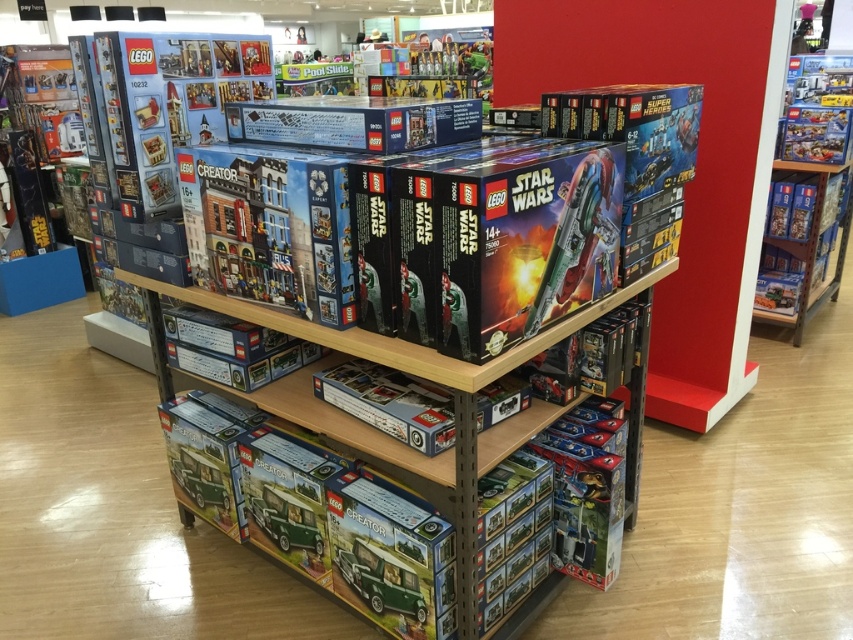
Question: Is matte blue building at center wider than green matte van at lower center?

Choices:
 (A) yes
 (B) no

Answer: (A)

Question: Which point is closer to the camera taking this photo?

Choices:
 (A) coord(412,611)
 (B) coord(267,234)

Answer: (B)

Question: Can you confirm if matte blue building at center is thinner than green matte van at lower center?

Choices:
 (A) no
 (B) yes

Answer: (A)

Question: Which of the following is the closest to the observer?

Choices:
 (A) glossy plastic spaceship at center
 (B) green matte van at lower center

Answer: (A)

Question: Can you confirm if glossy plastic spaceship at center is thinner than green matte van at lower center?

Choices:
 (A) no
 (B) yes

Answer: (A)

Question: Estimate the real-world distances between objects in this image. Which object is farther from the matte blue building at center?

Choices:
 (A) glossy plastic spaceship at center
 (B) green matte van at lower center

Answer: (B)